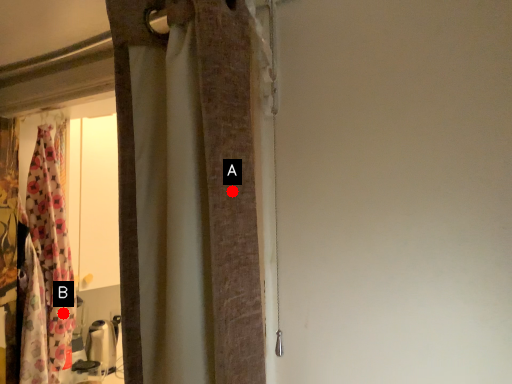
Question: Two points are circled on the image, labeled by A and B beside each circle. Which point is closer to the camera taking this photo?

Choices:
 (A) A is closer
 (B) B is closer

Answer: (A)